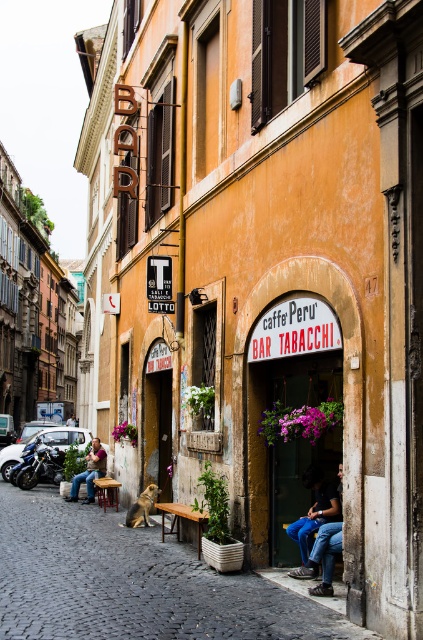
Does denim jeans at lower center have a greater width compared to brown wooden bench at lower center?

No.

Is denim jeans at lower center positioned at the back of brown wooden bench at lower center?

That is False.

Does point (316, 513) come closer to viewer compared to point (184, 506)?

Yes, point (316, 513) is closer to viewer.

Locate an element on the screen. The height and width of the screenshot is (640, 423). denim jeans at lower center is located at coordinates (315, 522).

Is leather jacket at lower left closer to camera compared to brown wooden park bench at center?

No, it is not.

Where is `leather jacket at lower left`? Image resolution: width=423 pixels, height=640 pixels. leather jacket at lower left is located at coordinates [90, 472].

I want to click on leather jacket at lower left, so click(x=90, y=472).

Between blue fabric bag at lower right and brown wooden bench at lower center, which one has less height?

With less height is brown wooden bench at lower center.

In the scene shown: Is the position of blue fabric bag at lower right more distant than that of brown wooden bench at lower center?

No, it is in front of brown wooden bench at lower center.

Is point (285, 611) closer to camera compared to point (164, 508)?

Yes, it is.

What are the coordinates of `blue fabric bag at lower right` in the screenshot? It's located at (132, 582).